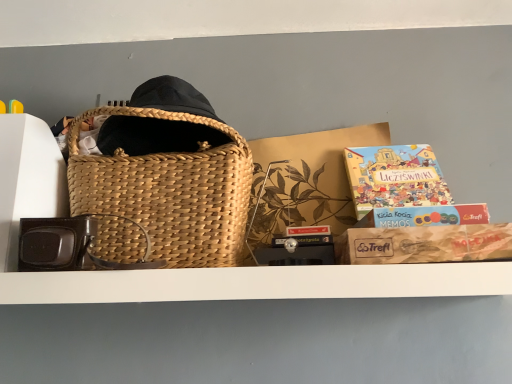
Locate an element on the screen. Image resolution: width=512 pixels, height=384 pixels. matte brown cardboard box at center is located at coordinates (306, 180).

Measure the distance between matte brown cardboard box at center and camera.

matte brown cardboard box at center is 34.94 inches from camera.

What is the approximate height of matte brown cardboard box at center?

matte brown cardboard box at center is 13.98 inches in height.

The width and height of the screenshot is (512, 384). Describe the element at coordinates (306, 180) in the screenshot. I see `matte brown cardboard box at center` at that location.

Locate an element on the screen. The width and height of the screenshot is (512, 384). matte brown cardboard box at center is located at coordinates (306, 180).